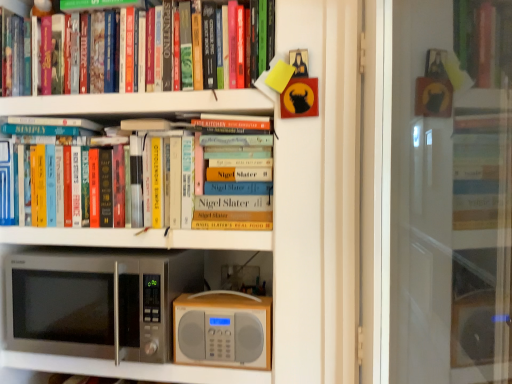
Question: Relative to transparent glass screen door at upper center, is hardcover books at center, placed as the 2th book when sorted from top to bottom, in front or behind?

Choices:
 (A) behind
 (B) front

Answer: (A)

Question: Considering the positions of hardcover books at center, placed as the 2th book when sorted from top to bottom, and transparent glass screen door at upper center in the image, is hardcover books at center, placed as the 2th book when sorted from top to bottom, bigger or smaller than transparent glass screen door at upper center?

Choices:
 (A) big
 (B) small

Answer: (B)

Question: Which object is positioned farthest from the hardcover books at center, placed as the 2th book when sorted from top to bottom?

Choices:
 (A) hardcover books at upper left, arranged as the 2th book when ordered from the bottom
 (B) satin silver microwave at lower left
 (C) transparent glass screen door at upper center
 (D) wooden radio at center

Answer: (C)

Question: Based on their relative distances, which object is nearer to the hardcover books at center, positioned as the 1th book in bottom-to-top order?

Choices:
 (A) wooden radio at center
 (B) transparent glass screen door at upper center
 (C) hardcover books at upper left, arranged as the 2th book when ordered from the bottom
 (D) satin silver microwave at lower left

Answer: (C)